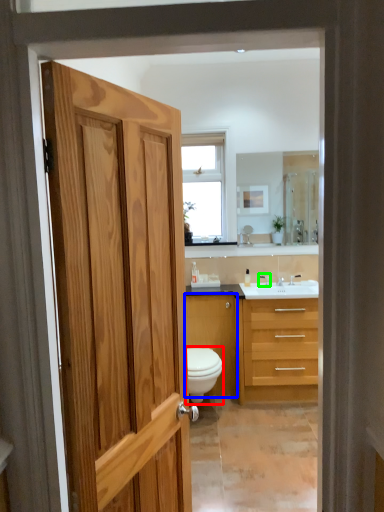
Question: Which object is positioned farthest from toilet (highlighted by a red box)? Select from cabinetry (highlighted by a blue box) and faucet (highlighted by a green box).

Choices:
 (A) cabinetry
 (B) faucet

Answer: (B)